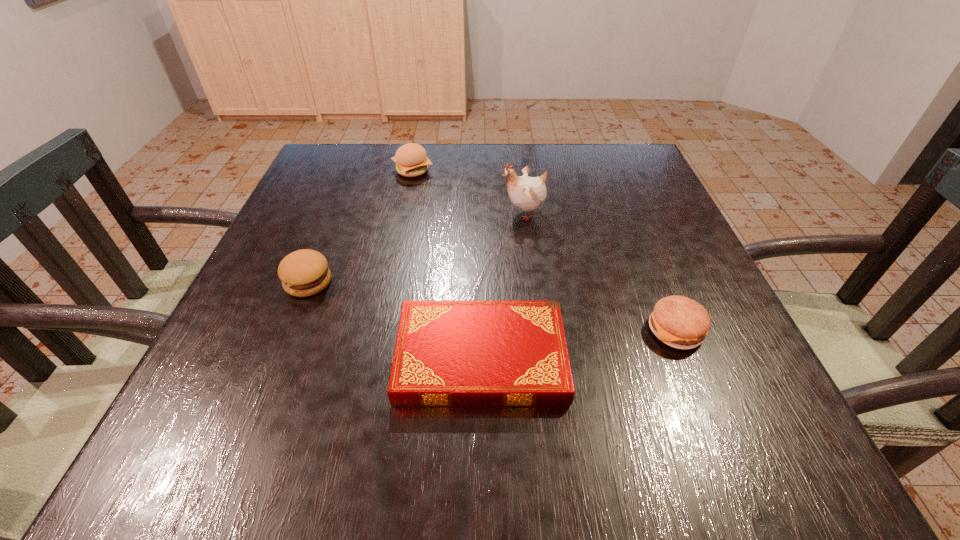
Where is `vacant area situated 0.130m at the beak of the bird`? The height and width of the screenshot is (540, 960). vacant area situated 0.130m at the beak of the bird is located at coordinates (444, 213).

Identify the location of free space located at the beak of the bird. The width and height of the screenshot is (960, 540). (334, 213).

At what (x,y) coordinates should I click in order to perform the action: click on free space located on the front of the farthest object. Please return your answer as a coordinate pair (x, y). The image size is (960, 540). Looking at the image, I should click on (405, 205).

The width and height of the screenshot is (960, 540). I want to click on free space located on the front of the leftmost object, so click(x=246, y=439).

Locate an element on the screen. The image size is (960, 540). free space located on the back of the rightmost object is located at coordinates (626, 209).

You are a GUI agent. You are given a task and a screenshot of the screen. Output one action in this format:
    pyautogui.click(x=<x>, y=<y>)
    Task: Click on the free space located 0.090m on the cover of the hardback book
    The height and width of the screenshot is (540, 960).
    Given the screenshot: What is the action you would take?
    pyautogui.click(x=343, y=357)

Where is `free space located 0.130m on the cover of the hardback book`? free space located 0.130m on the cover of the hardback book is located at coordinates (319, 357).

Identify the location of blank area located 0.180m on the cover of the hardback book. The width and height of the screenshot is (960, 540). (288, 357).

Where is `object present at the far edge`? The image size is (960, 540). object present at the far edge is located at coordinates (411, 160).

Locate an element on the screen. The height and width of the screenshot is (540, 960). object that is at the left edge is located at coordinates (305, 272).